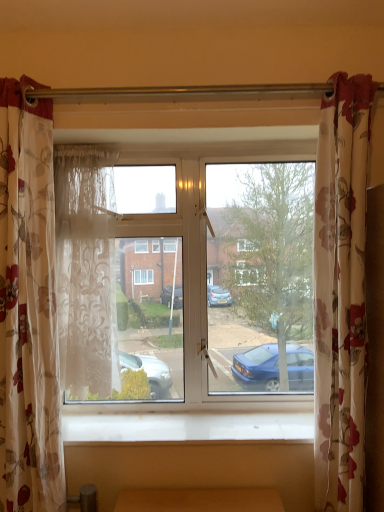
Question: Is white wood at lower center outside of sheer floral fabric curtain at left, which ranks as the 2th curtain in right-to-left order?

Choices:
 (A) no
 (B) yes

Answer: (B)

Question: Does white wood at lower center have a lesser height compared to sheer floral fabric curtain at left, which ranks as the 2th curtain in left-to-right order?

Choices:
 (A) yes
 (B) no

Answer: (A)

Question: From a real-world perspective, is white wood at lower center physically above sheer floral fabric curtain at left, which ranks as the 2th curtain in left-to-right order?

Choices:
 (A) no
 (B) yes

Answer: (A)

Question: From a real-world perspective, is white wood at lower center positioned under sheer floral fabric curtain at left, which ranks as the 2th curtain in left-to-right order, based on gravity?

Choices:
 (A) no
 (B) yes

Answer: (B)

Question: Is white wood at lower center oriented away from sheer floral fabric curtain at left, which ranks as the 2th curtain in left-to-right order?

Choices:
 (A) yes
 (B) no

Answer: (B)

Question: From a real-world perspective, is floral fabric curtain at right, which is the 1th curtain from right to left, positioned above or below clear glass window at center?

Choices:
 (A) below
 (B) above

Answer: (A)

Question: Do you think floral fabric curtain at right, the 3th curtain when ordered from left to right, is within clear glass window at center, or outside of it?

Choices:
 (A) outside
 (B) inside

Answer: (A)

Question: From the image's perspective, is floral fabric curtain at right, which is the 1th curtain from right to left, positioned above or below clear glass window at center?

Choices:
 (A) below
 (B) above

Answer: (A)

Question: Based on their sizes in the image, would you say floral fabric curtain at right, which is the 1th curtain from right to left, is bigger or smaller than clear glass window at center?

Choices:
 (A) big
 (B) small

Answer: (B)

Question: Would you say white wood at lower center is to the left or to the right of floral fabric curtain at left, the 3th curtain when ordered from right to left, in the picture?

Choices:
 (A) right
 (B) left

Answer: (A)

Question: Would you say white wood at lower center is inside or outside floral fabric curtain at left, which is the 1th curtain in left-to-right order?

Choices:
 (A) outside
 (B) inside

Answer: (A)

Question: From the image's perspective, is white wood at lower center positioned above or below floral fabric curtain at left, which is the 1th curtain in left-to-right order?

Choices:
 (A) below
 (B) above

Answer: (A)

Question: In terms of width, does white wood at lower center look wider or thinner when compared to floral fabric curtain at left, the 3th curtain when ordered from right to left?

Choices:
 (A) wide
 (B) thin

Answer: (A)

Question: Is white wood at lower center to the left or to the right of clear glass window at center in the image?

Choices:
 (A) right
 (B) left

Answer: (A)

Question: Considering the positions of white wood at lower center and clear glass window at center in the image, is white wood at lower center bigger or smaller than clear glass window at center?

Choices:
 (A) small
 (B) big

Answer: (A)